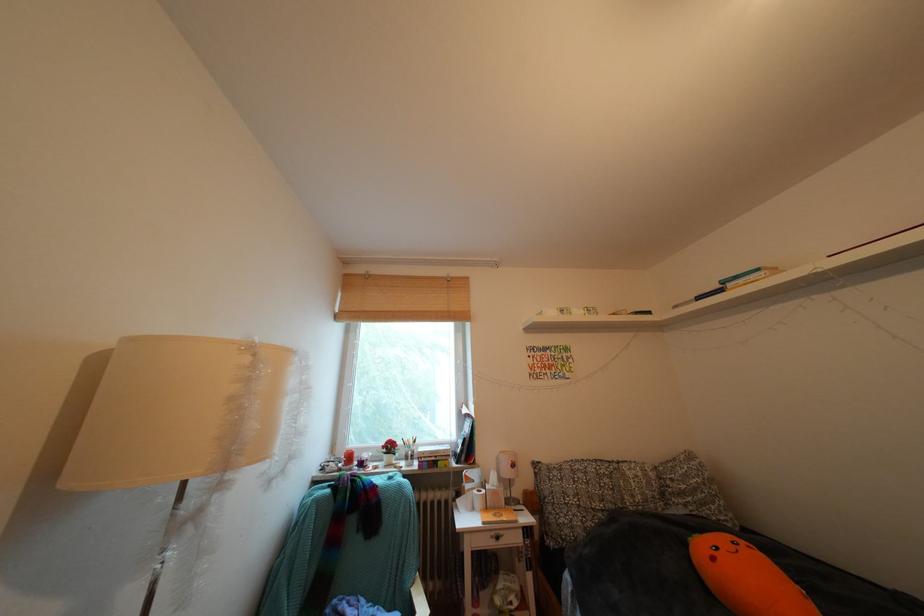
Locate an element on the screen. The width and height of the screenshot is (924, 616). orange carrot pillow is located at coordinates (746, 578).